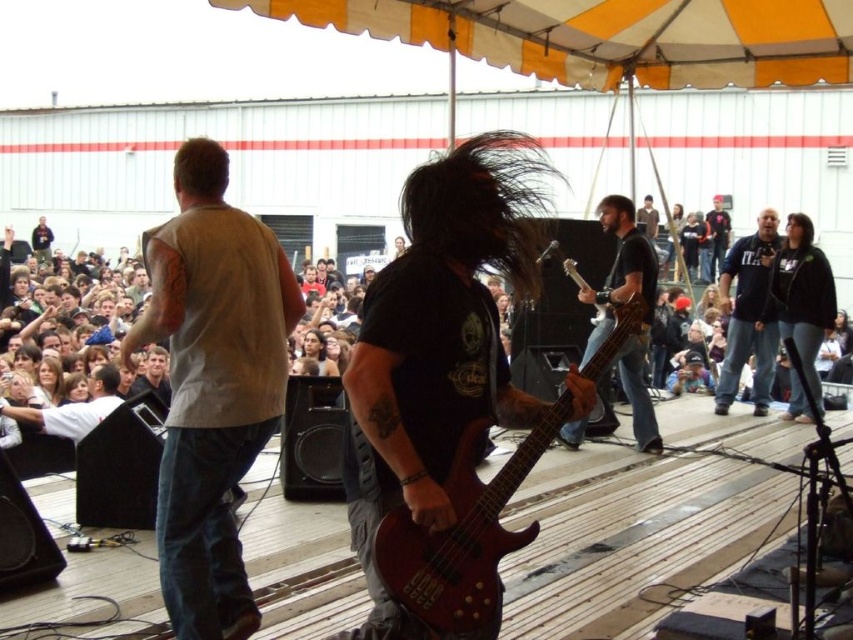
Question: Which point is closer to the camera taking this photo?

Choices:
 (A) (39, 241)
 (B) (643, 230)

Answer: (B)

Question: Does mahogany wood bass at center appear over dark gray shirt at center?

Choices:
 (A) yes
 (B) no

Answer: (B)

Question: Is dark blue t-shirt at right to the right of dark brown leather jacket at center from the viewer's perspective?

Choices:
 (A) no
 (B) yes

Answer: (A)

Question: Which point is closer to the camera?

Choices:
 (A) (39, 216)
 (B) (148, 356)
 (C) (654, 225)

Answer: (B)

Question: Among these points, which one is nearest to the camera?

Choices:
 (A) (334, 371)
 (B) (619, 308)

Answer: (B)

Question: Can you confirm if matte black guitar at center is bigger than matte beige tank top at center?

Choices:
 (A) yes
 (B) no

Answer: (B)